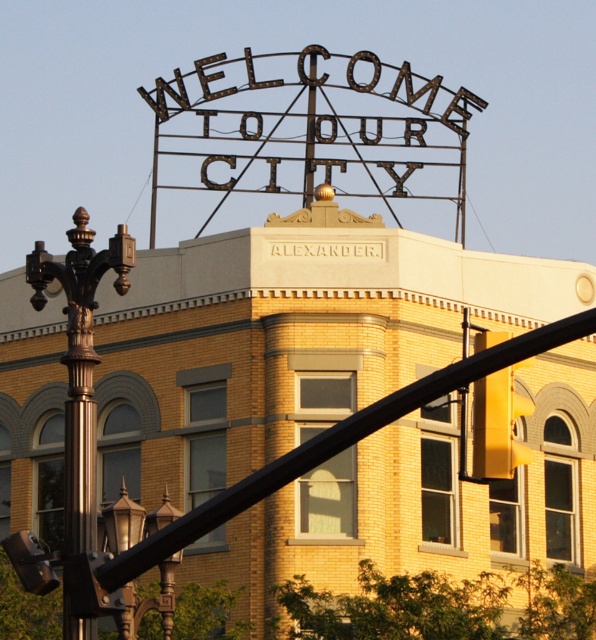
You are a city planner assessing the street lighting in the area. The polished bronze street light at left and the yellow matte traffic light at center are both present. Which one do you think will provide a wider coverage area for illumination?

The polished bronze street light at left has a larger size compared to the yellow matte traffic light at center, so it will provide a wider coverage area for illumination.